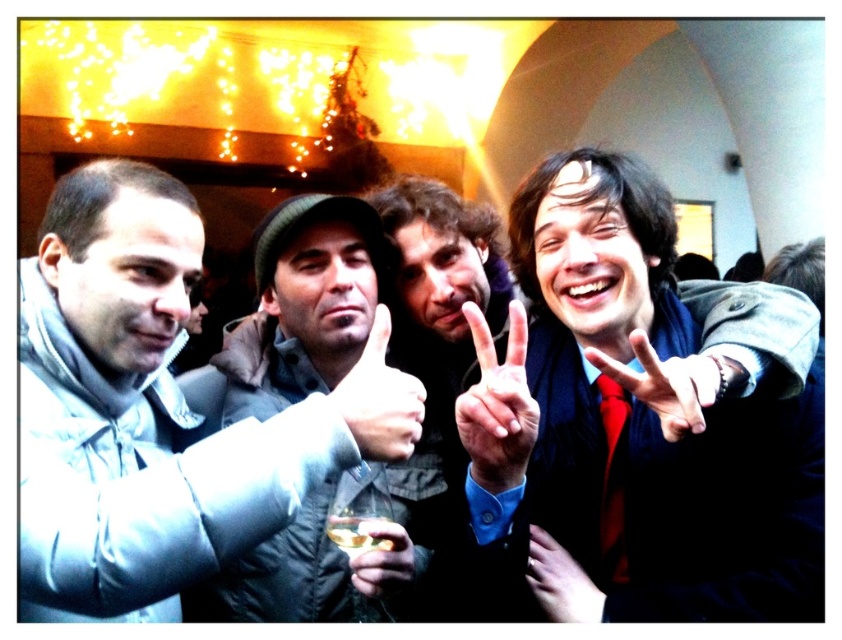
Question: Does white matte hand at center appear under matte black hand at center?

Choices:
 (A) no
 (B) yes

Answer: (B)

Question: Considering the real-world distances, which object is closest to the matte black hand at center right?

Choices:
 (A) gray matte jacket at upper left
 (B) matte black jacket at center
 (C) matte black hand at center
 (D) translucent glass at center

Answer: (B)

Question: Which point is farther to the camera?

Choices:
 (A) (569, 282)
 (B) (477, 342)

Answer: (A)

Question: Is matte black hand at center bigger than red silk tie at center?

Choices:
 (A) no
 (B) yes

Answer: (B)

Question: Which of the following is the closest to the observer?

Choices:
 (A) matte black hand at center right
 (B) translucent glass at center
 (C) matte black hand at center

Answer: (C)

Question: Does smooth skin hand at center have a larger size compared to matte gold ring at center?

Choices:
 (A) yes
 (B) no

Answer: (B)